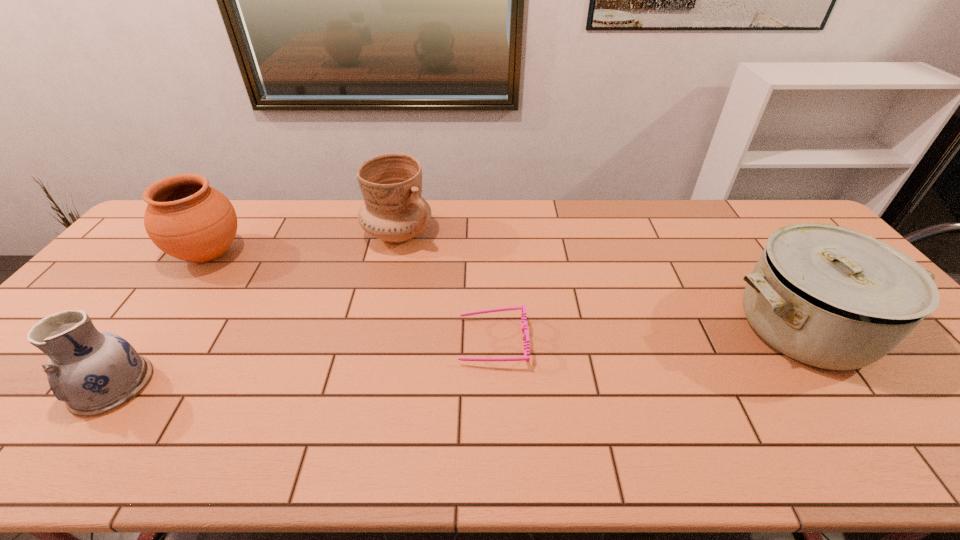
Select which object is the fourth closest to the spectacles. Please provide its 2D coordinates. Your answer should be formatted as a tuple, i.e. [(x, y)], where the tuple contains the x and y coordinates of a point satisfying the conditions above.

[(93, 372)]

Point out which pottery is positioned as the second nearest to the rightmost pottery. Please provide its 2D coordinates. Your answer should be formatted as a tuple, i.e. [(x, y)], where the tuple contains the x and y coordinates of a point satisfying the conditions above.

[(93, 372)]

Locate an element on the screen. The height and width of the screenshot is (540, 960). pottery object that ranks as the third closest to the saucepan is located at coordinates (93, 372).